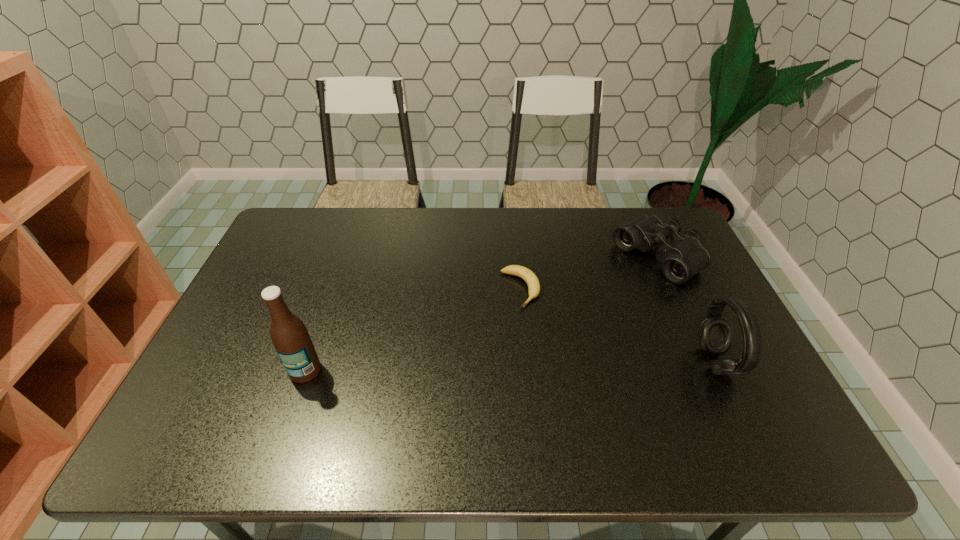
What are the coordinates of `vacant space situated at the stem of the banana` in the screenshot? It's located at (543, 327).

You are a GUI agent. You are given a task and a screenshot of the screen. Output one action in this format:
    pyautogui.click(x=<x>, y=<y>)
    Task: Click on the free space located 0.210m at the eyepieces of the binoculars
    Image resolution: width=960 pixels, height=540 pixels.
    Given the screenshot: What is the action you would take?
    pyautogui.click(x=583, y=307)

I want to click on free space located 0.330m at the eyepieces of the binoculars, so click(553, 326).

Where is `vacant space located at the eyepieces of the binoculars`? vacant space located at the eyepieces of the binoculars is located at coordinates (564, 319).

You are a GUI agent. You are given a task and a screenshot of the screen. Output one action in this format:
    pyautogui.click(x=<x>, y=<y>)
    Task: Click on the object that is at the far edge
    The image size is (960, 540).
    Given the screenshot: What is the action you would take?
    pyautogui.click(x=685, y=256)

Where is `beer bottle at the near edge`? Image resolution: width=960 pixels, height=540 pixels. beer bottle at the near edge is located at coordinates (292, 342).

Where is `headset positioned at the near edge`? This screenshot has width=960, height=540. headset positioned at the near edge is located at coordinates (715, 333).

Identify the location of headset that is positioned at the right edge. (715, 333).

Find the location of a particular element. The width and height of the screenshot is (960, 540). binoculars that is at the right edge is located at coordinates (685, 256).

Where is `object that is at the far right corner`? This screenshot has height=540, width=960. object that is at the far right corner is located at coordinates (685, 256).